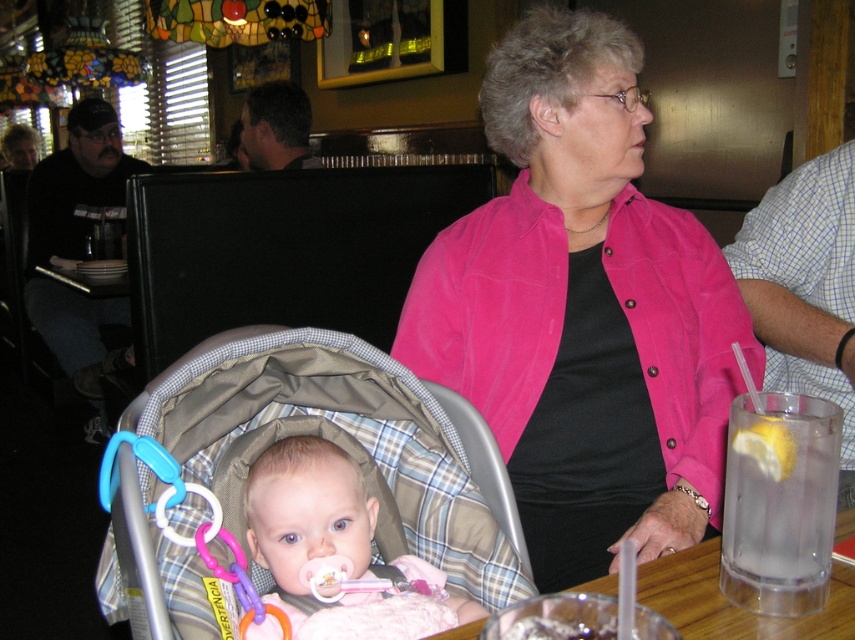
Question: Which point is farther from the camera taking this photo?

Choices:
 (A) (175, 483)
 (B) (441, 524)
 (C) (675, 548)
 (D) (555, 268)

Answer: (D)

Question: Which object is closer to the camera taking this photo?

Choices:
 (A) clear glass table at lower center
 (B) plastic/soft baby rattle at center

Answer: (A)

Question: Does plaid fabric baby carriage at center come behind plastic/soft baby rattle at center?

Choices:
 (A) yes
 (B) no

Answer: (A)

Question: Is pink fabric jacket at center behind pink plastic teething ring at lower center?

Choices:
 (A) yes
 (B) no

Answer: (A)

Question: Which object is positioned farthest from the clear glass table at lower center?

Choices:
 (A) pink fabric jacket at center
 (B) pink plastic teething ring at lower center

Answer: (A)

Question: Is the position of pink fabric jacket at center less distant than that of clear glass table at lower center?

Choices:
 (A) no
 (B) yes

Answer: (A)